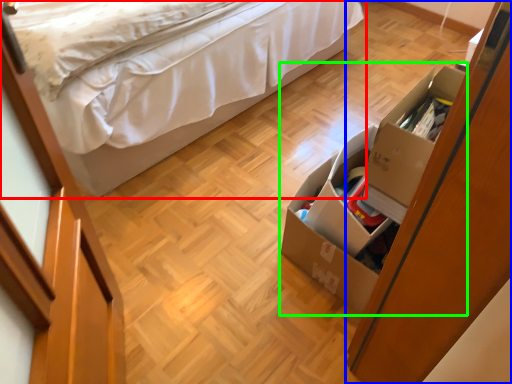
Question: Which object is positioned closest to bed (highlighted by a red box)? Select from dresser (highlighted by a blue box) and storage box (highlighted by a green box).

Choices:
 (A) dresser
 (B) storage box

Answer: (B)